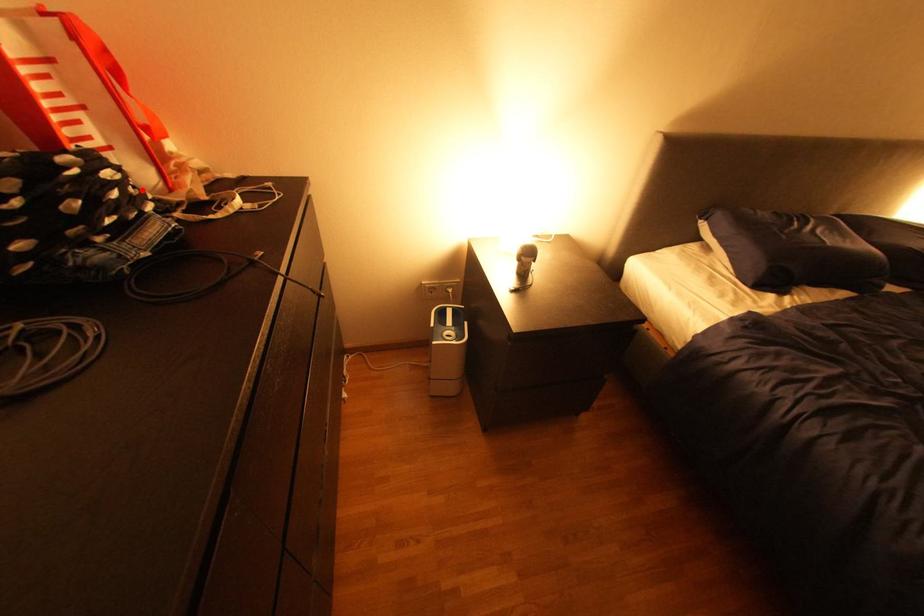
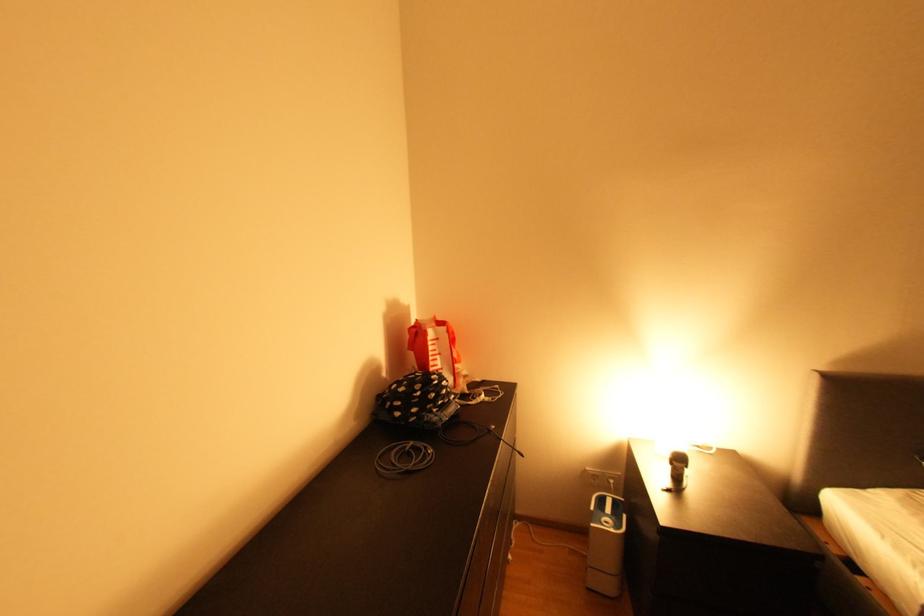
Find the pixel in the second image that matches the highlighted location in the first image.

(457, 389)